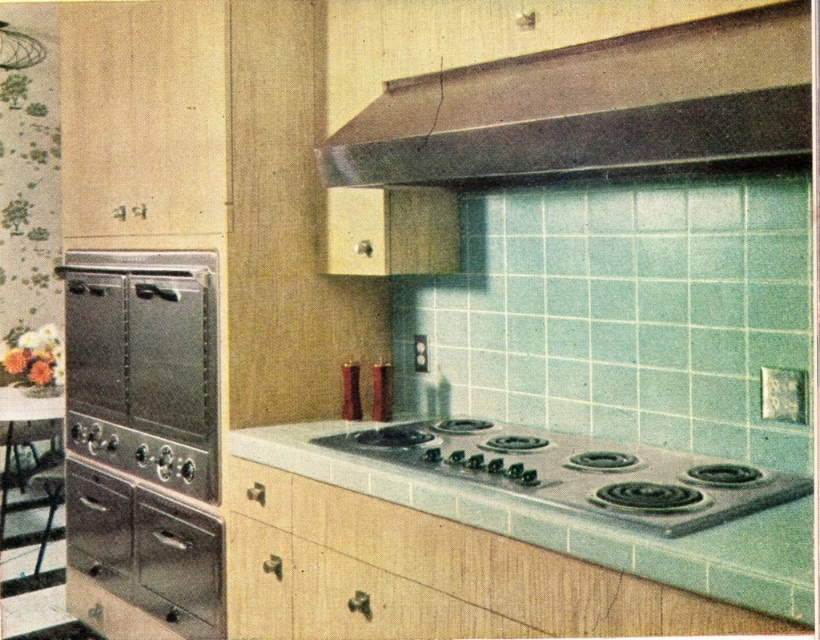
Is metallic brown exhaust hood at upper center thinner than wooden drawer at lower center?

No.

Find the location of `metallic brown exhaust hood at upper center`. metallic brown exhaust hood at upper center is located at coordinates (591, 106).

How distant is white laminate countertop at center from silver metallic gas stove at center?

white laminate countertop at center and silver metallic gas stove at center are 2.11 inches apart.

Measure the distance between point (468, 513) and camera.

Point (468, 513) and camera are 5.62 feet apart from each other.

Locate an element on the screen. white laminate countertop at center is located at coordinates (567, 520).

Image resolution: width=820 pixels, height=640 pixels. Find the location of `white laminate countertop at center`. white laminate countertop at center is located at coordinates point(567,520).

Consider the image. Measure the distance between stainless steel oven at left and wooden drawer at lower center.

stainless steel oven at left and wooden drawer at lower center are 19.67 inches apart from each other.

Is stainless steel oven at left bigger than wooden drawer at lower center?

Correct, stainless steel oven at left is larger in size than wooden drawer at lower center.

At what (x,y) coordinates should I click in order to perform the action: click on stainless steel oven at left. Please return your answer as a coordinate pair (x, y). This screenshot has height=640, width=820. Looking at the image, I should click on (144, 444).